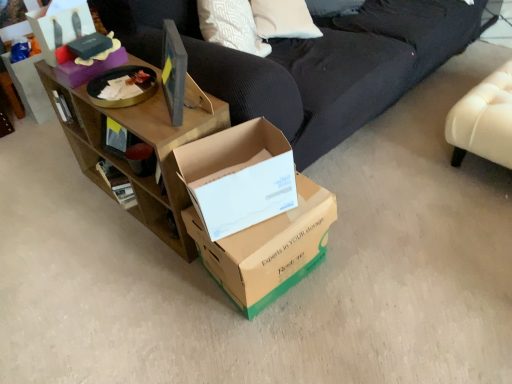
Question: Is brown wood shelf at upper left a part of brown cardboard box at center, which appears as the 1th box when ordered from the bottom?

Choices:
 (A) no
 (B) yes

Answer: (A)

Question: Could you tell me if brown cardboard box at center, arranged as the 1th box when viewed from the right, is turned towards brown wood shelf at upper left?

Choices:
 (A) yes
 (B) no

Answer: (B)

Question: Can you confirm if brown cardboard box at center, which appears as the 1th box when ordered from the bottom, is wider than brown wood shelf at upper left?

Choices:
 (A) no
 (B) yes

Answer: (B)

Question: Is brown cardboard box at center, positioned as the third box in left-to-right order, in contact with brown wood shelf at upper left?

Choices:
 (A) yes
 (B) no

Answer: (B)

Question: Is brown cardboard box at center, positioned as the third box in left-to-right order, not near brown wood shelf at upper left?

Choices:
 (A) no
 (B) yes

Answer: (A)

Question: In terms of width, does cardboard box at center, the 2th box in the top-to-bottom sequence, look wider or thinner when compared to brown cardboard box at center, positioned as the third box in left-to-right order?

Choices:
 (A) thin
 (B) wide

Answer: (A)

Question: From a real-world perspective, is cardboard box at center, which is counted as the 2th box, starting from the left, positioned above or below brown cardboard box at center, the 3th box from the top?

Choices:
 (A) below
 (B) above

Answer: (B)

Question: In the image, is cardboard box at center, the 2th box in the top-to-bottom sequence, on the left side or the right side of brown cardboard box at center, arranged as the 1th box when viewed from the right?

Choices:
 (A) right
 (B) left

Answer: (B)

Question: From the image's perspective, relative to brown cardboard box at center, positioned as the third box in left-to-right order, is cardboard box at center, the second box in the bottom-to-top sequence, above or below?

Choices:
 (A) below
 (B) above

Answer: (B)

Question: Would you say brown wood shelf at upper left is inside or outside matte black box at upper left, which is counted as the first box, starting from the left?

Choices:
 (A) inside
 (B) outside

Answer: (B)

Question: Is brown wood shelf at upper left in front of or behind matte black box at upper left, which is counted as the first box, starting from the left, in the image?

Choices:
 (A) behind
 (B) front

Answer: (B)

Question: Is brown wood shelf at upper left bigger or smaller than matte black box at upper left, which is counted as the first box, starting from the left?

Choices:
 (A) big
 (B) small

Answer: (A)

Question: Is brown wood shelf at upper left to the left or to the right of matte black box at upper left, placed as the 1th box when sorted from top to bottom, in the image?

Choices:
 (A) right
 (B) left

Answer: (A)

Question: Is cardboard box at center, the 2th box in the top-to-bottom sequence, inside or outside of brown wood shelf at upper left?

Choices:
 (A) inside
 (B) outside

Answer: (B)

Question: Looking at their shapes, would you say cardboard box at center, which is counted as the 2th box, starting from the left, is wider or thinner than brown wood shelf at upper left?

Choices:
 (A) thin
 (B) wide

Answer: (A)